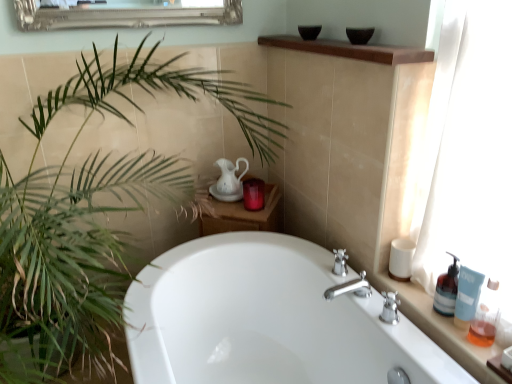
Question: Is white glossy bathtub at center wider or thinner than translucent plastic bottles at right, acting as the second counter top starting from the top?

Choices:
 (A) thin
 (B) wide

Answer: (B)

Question: In the image, is white glossy bathtub at center positioned in front of or behind translucent plastic bottles at right, which is the first counter top from right to left?

Choices:
 (A) front
 (B) behind

Answer: (A)

Question: Considering the real-world distances, which object is closest to the brown wood shelf at upper center, the 1th counter top in the left-to-right sequence?

Choices:
 (A) translucent plastic soap dispenser at right, positioned as the second soap dispenser in back-to-front order
 (B) translucent plastic bottles at right, marked as the first counter top in a bottom-to-top arrangement
 (C) white ceramic pitcher at center
 (D) blue matte tube at right, the third toiletry from the back
 (E) green leafy plant at left

Answer: (C)

Question: Estimate the real-world distances between objects in this image. Which object is closer to the translucent glass soap dispenser at right, the first soap dispenser positioned from the back?

Choices:
 (A) blue matte tube at right, the third toiletry from the back
 (B) matte glass candle at upper center, the 1th toiletry in the top-to-bottom sequence
 (C) white matte cup at right, which is the 2th toiletry in right-to-left order
 (D) translucent plastic bottles at right, which is the first counter top from right to left
 (E) green leafy plant at left

Answer: (A)